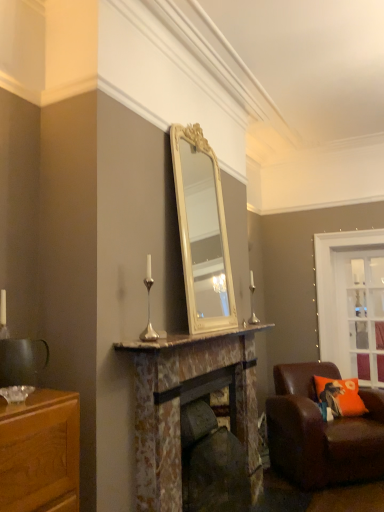
Question: Considering the positions of marble mantel at center and silver metallic candle holder at right, which is counted as the second candle holder, starting from the front, in the image, is marble mantel at center bigger or smaller than silver metallic candle holder at right, which is counted as the second candle holder, starting from the front,?

Choices:
 (A) small
 (B) big

Answer: (B)

Question: From a real-world perspective, relative to silver metallic candle holder at right, marked as the first candle holder in a back-to-front arrangement, is marble mantel at center vertically above or below?

Choices:
 (A) above
 (B) below

Answer: (B)

Question: Which object is positioned farthest from the clear glass door at upper right?

Choices:
 (A) rustic stone fireplace at center, the second fireplace in the front-to-back sequence
 (B) marble fireplace at center, the second fireplace from the back
 (C) matte black mug at left
 (D) silver metallic candle holder at center, arranged as the 1th candle holder when viewed from the left
 (E) brown leather chair at lower right

Answer: (C)

Question: Estimate the real-world distances between objects in this image. Which object is farther from the silver metallic candle holder at center, the first candle holder viewed from the front?

Choices:
 (A) marble mantel at center
 (B) brown leather chair at lower right
 (C) matte black mug at left
 (D) silver metallic candle holder at right, acting as the second candle holder starting from the left
 (E) orange fabric pillow at lower right

Answer: (D)